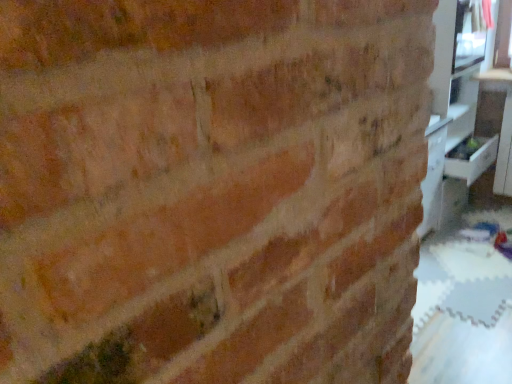
Question: Can you confirm if white glossy drawer at right is bigger than white glossy entertainment center at right?

Choices:
 (A) no
 (B) yes

Answer: (A)

Question: Is white glossy drawer at right in contact with white glossy entertainment center at right?

Choices:
 (A) yes
 (B) no

Answer: (B)

Question: Can you confirm if white glossy drawer at right is shorter than white glossy entertainment center at right?

Choices:
 (A) no
 (B) yes

Answer: (B)

Question: From a real-world perspective, is white glossy drawer at right on top of white glossy entertainment center at right?

Choices:
 (A) yes
 (B) no

Answer: (B)

Question: Can you confirm if white glossy drawer at right is positioned to the right of white glossy entertainment center at right?

Choices:
 (A) yes
 (B) no

Answer: (A)

Question: Is white glossy drawer at right outside of white glossy entertainment center at right?

Choices:
 (A) no
 (B) yes

Answer: (A)

Question: Does white glossy entertainment center at right appear on the left side of white glossy drawer at right?

Choices:
 (A) no
 (B) yes

Answer: (B)

Question: Does white glossy entertainment center at right have a lesser width compared to white glossy drawer at right?

Choices:
 (A) no
 (B) yes

Answer: (A)

Question: Could you tell me if white glossy entertainment center at right is facing white glossy drawer at right?

Choices:
 (A) no
 (B) yes

Answer: (B)

Question: Is white glossy entertainment center at right further to camera compared to white glossy drawer at right?

Choices:
 (A) no
 (B) yes

Answer: (A)

Question: Does white glossy entertainment center at right have a lesser height compared to white glossy drawer at right?

Choices:
 (A) no
 (B) yes

Answer: (A)

Question: Is white glossy entertainment center at right positioned beyond the bounds of white glossy drawer at right?

Choices:
 (A) no
 (B) yes

Answer: (B)

Question: Relative to white glossy drawer at right, is white glossy entertainment center at right in front or behind?

Choices:
 (A) behind
 (B) front

Answer: (B)